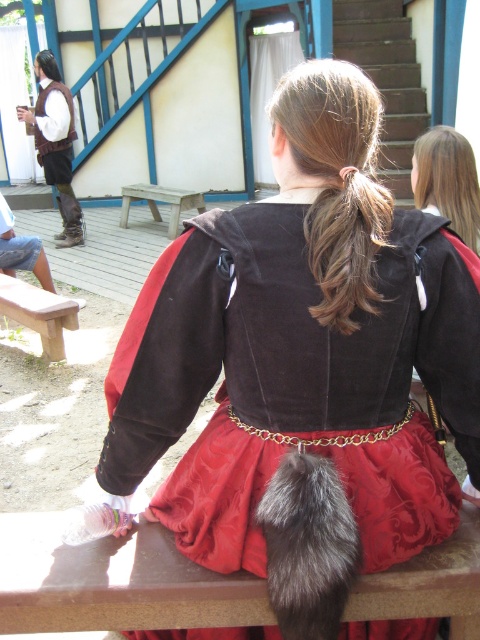
Question: Considering the real-world distances, which object is farthest from the fuzzy fur ponytail at upper center?

Choices:
 (A) wooden park bench at center
 (B) velvet brown dress at center
 (C) wooden picnic table at lower center

Answer: (A)

Question: Is wooden picnic table at lower center below wooden park bench at center?

Choices:
 (A) no
 (B) yes

Answer: (B)

Question: Which point is farther to the camera?

Choices:
 (A) (360, 179)
 (B) (322, 500)

Answer: (A)

Question: Considering the real-world distances, which object is closest to the brown silky hair at upper center?

Choices:
 (A) shiny brown hair at upper right
 (B) velvet brown dress at center
 (C) fuzzy fur ponytail at upper center
 (D) wooden park bench at center

Answer: (B)

Question: Is shiny brown hair at upper right to the left of wooden park bench at center from the viewer's perspective?

Choices:
 (A) yes
 (B) no

Answer: (B)

Question: Can you confirm if shiny brown hair at upper right is thinner than wooden park bench at center?

Choices:
 (A) yes
 (B) no

Answer: (A)